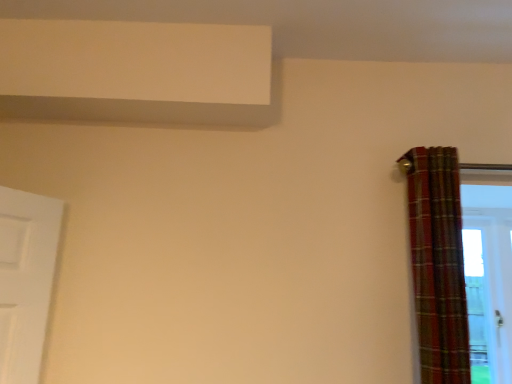
Measure the distance between point (435, 163) and camera.

Point (435, 163) is 5.34 feet away from camera.

In order to click on plaid fabric curtain at right in this screenshot , I will do `click(438, 263)`.

What do you see at coordinates (438, 263) in the screenshot? Image resolution: width=512 pixels, height=384 pixels. I see `plaid fabric curtain at right` at bounding box center [438, 263].

Identify the location of plaid fabric curtain at right. The width and height of the screenshot is (512, 384). (438, 263).